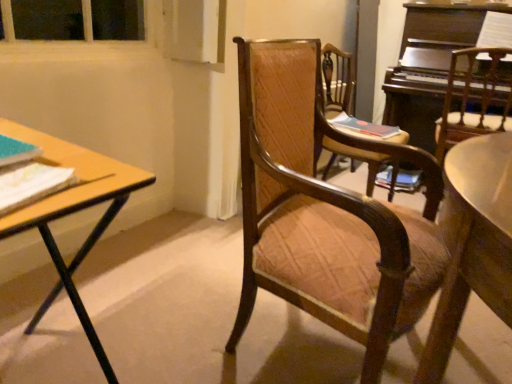
What are the coordinates of `vacant space underneath wooden chair at center, the 3th chair in the right-to-left sequence (from a real-world perspective)` in the screenshot? It's located at (297, 347).